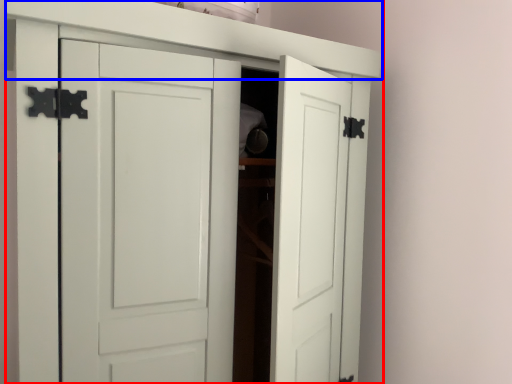
Question: Which object is further to the camera taking this photo, cupboard (highlighted by a red box) or shelf (highlighted by a blue box)?

Choices:
 (A) cupboard
 (B) shelf

Answer: (B)